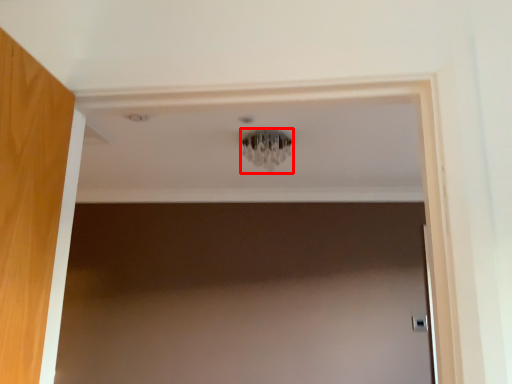
Question: In this image, where is light fixture (annotated by the red box) located relative to door handle?

Choices:
 (A) left
 (B) right

Answer: (A)